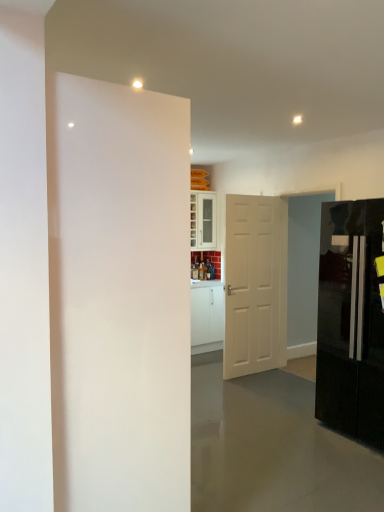
Question: Is white glossy door at left, the 1th door in the front-to-back sequence, outside glossy black refrigerator at right?

Choices:
 (A) yes
 (B) no

Answer: (A)

Question: Can you confirm if white glossy door at left, the 1th door in the front-to-back sequence, is smaller than glossy black refrigerator at right?

Choices:
 (A) yes
 (B) no

Answer: (A)

Question: Considering the relative sizes of white glossy door at left, marked as the first door in a left-to-right arrangement, and glossy black refrigerator at right in the image provided, is white glossy door at left, marked as the first door in a left-to-right arrangement, wider than glossy black refrigerator at right?

Choices:
 (A) yes
 (B) no

Answer: (B)

Question: Can you confirm if white glossy door at left, marked as the 2th door in a right-to-left arrangement, is thinner than glossy black refrigerator at right?

Choices:
 (A) yes
 (B) no

Answer: (A)

Question: Is white glossy door at left, the 1th door in the front-to-back sequence, taller than glossy black refrigerator at right?

Choices:
 (A) yes
 (B) no

Answer: (A)

Question: Is white glossy cabinet at center situated inside white glossy door at left, marked as the first door in a left-to-right arrangement, or outside?

Choices:
 (A) outside
 (B) inside

Answer: (A)

Question: Based on their positions, is white glossy cabinet at center located to the left or right of white glossy door at left, the 1th door in the front-to-back sequence?

Choices:
 (A) left
 (B) right

Answer: (B)

Question: Is white glossy cabinet at center wider or thinner than white glossy door at left, marked as the first door in a left-to-right arrangement?

Choices:
 (A) wide
 (B) thin

Answer: (B)

Question: Is point (196, 199) closer or farther from the camera than point (167, 323)?

Choices:
 (A) closer
 (B) farther

Answer: (B)

Question: From a real-world perspective, is white matte door at center, the second door viewed from the front, positioned above or below white glossy door at left, marked as the first door in a left-to-right arrangement?

Choices:
 (A) below
 (B) above

Answer: (A)

Question: Is white matte door at center, the second door viewed from the front, in front of or behind white glossy door at left, acting as the 2th door starting from the back, in the image?

Choices:
 (A) front
 (B) behind

Answer: (B)

Question: Is point (253, 239) positioned closer to the camera than point (71, 228)?

Choices:
 (A) closer
 (B) farther

Answer: (B)

Question: In terms of size, does white matte door at center, which ranks as the 1th door in back-to-front order, appear bigger or smaller than white glossy door at left, the 1th door in the front-to-back sequence?

Choices:
 (A) small
 (B) big

Answer: (A)

Question: Considering the relative positions of white matte door at center, acting as the first door starting from the right, and glossy black refrigerator at right in the image provided, is white matte door at center, acting as the first door starting from the right, to the left or to the right of glossy black refrigerator at right?

Choices:
 (A) left
 (B) right

Answer: (A)

Question: From the image's perspective, is white matte door at center, which ranks as the 1th door in back-to-front order, positioned above or below glossy black refrigerator at right?

Choices:
 (A) below
 (B) above

Answer: (B)